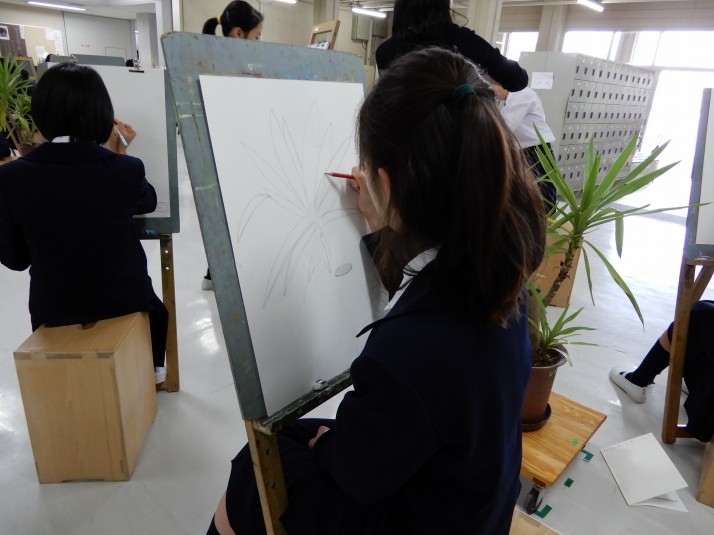
Identify the location of easel. click(x=178, y=76), click(x=161, y=229), click(x=321, y=35), click(x=703, y=180).